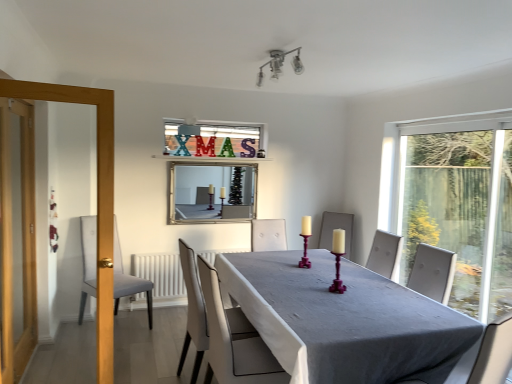
Question: From the image's perspective, is smooth gray table at center located above or below metallic glass light fixture at upper center?

Choices:
 (A) above
 (B) below

Answer: (B)

Question: Considering the positions of smooth gray table at center and metallic glass light fixture at upper center in the image, is smooth gray table at center taller or shorter than metallic glass light fixture at upper center?

Choices:
 (A) short
 (B) tall

Answer: (B)

Question: Which of these objects is positioned farthest from the metallic glass light fixture at upper center?

Choices:
 (A) smooth gray table at center
 (B) white leather chair at center, acting as the 1th chair starting from the front
 (C) purple wood candle holder at center, placed as the 2th candle holder when sorted from right to left
 (D) white matte radiator at lower center
 (E) transparent glass window at right

Answer: (E)

Question: Considering the real-world distances, which object is closest to the transparent glass window at right?

Choices:
 (A) purple wood candle holder at center, positioned as the 1th candle holder in back-to-front order
 (B) metallic glass light fixture at upper center
 (C) white leather chair at center, acting as the 1th chair starting from the front
 (D) gray fabric chair at left, the 1th chair viewed from the left
 (E) white matte radiator at lower center

Answer: (A)